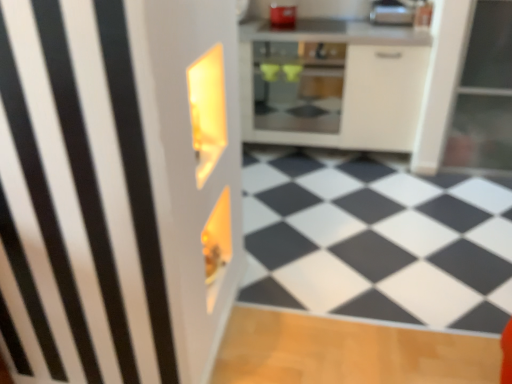
Measure the distance between point (351,105) and camera.

They are 9.46 feet apart.

In order to face silver metallic toaster at upper right, which ranks as the first appliance in right-to-left order, should I rotate leftwards or rightwards?

A 17.319 degree turn to the right will do.

Locate an element on the screen. white glossy cabinet at center is located at coordinates (332, 84).

From a real-world perspective, is white glossy cabinet at center under metallic silver toaster at upper center, which is the second appliance in right-to-left order?

Yes, from a real-world perspective, white glossy cabinet at center is beneath metallic silver toaster at upper center, which is the second appliance in right-to-left order.

Could you tell me if white glossy cabinet at center is turned towards metallic silver toaster at upper center, which is the second appliance in right-to-left order?

No, white glossy cabinet at center is not aimed at metallic silver toaster at upper center, which is the second appliance in right-to-left order.

Is white glossy cabinet at center beside metallic silver toaster at upper center, positioned as the 1th appliance in left-to-right order?

white glossy cabinet at center and metallic silver toaster at upper center, positioned as the 1th appliance in left-to-right order, are not in contact.

I want to click on the 1st appliance above the matte glass oven at center (from the image's perspective), so click(392, 12).

Is matte glass oven at center bigger than silver metallic toaster at upper right, which ranks as the first appliance in right-to-left order?

Yes.

Could you tell me if matte glass oven at center is turned towards silver metallic toaster at upper right, the 2th appliance when ordered from left to right?

No, matte glass oven at center does not turn towards silver metallic toaster at upper right, the 2th appliance when ordered from left to right.

Are matte glass oven at center and silver metallic toaster at upper right, which ranks as the first appliance in right-to-left order, located far from each other?

That's not correct — matte glass oven at center is a little close to silver metallic toaster at upper right, which ranks as the first appliance in right-to-left order.

From a real-world perspective, is metallic silver toaster at upper center, positioned as the 1th appliance in left-to-right order, on top of matte glass oven at center?

Correct, in the physical world, metallic silver toaster at upper center, positioned as the 1th appliance in left-to-right order, is higher than matte glass oven at center.

Does metallic silver toaster at upper center, which is the second appliance in right-to-left order, come in front of matte glass oven at center?

No, metallic silver toaster at upper center, which is the second appliance in right-to-left order, is further to the viewer.

Can we say metallic silver toaster at upper center, positioned as the 1th appliance in left-to-right order, lies outside matte glass oven at center?

Yes.

In the scene shown: How many degrees apart are the facing directions of metallic silver toaster at upper center, which is the second appliance in right-to-left order, and matte glass oven at center?

0.00147 degrees.

From a real-world perspective, which object stands above the other?

In real-world perspective, silver metallic toaster at upper right, the 2th appliance when ordered from left to right, is above.

From the image's perspective, starting from the matte glass oven at center, which appliance is the 1st one above? Please provide its 2D coordinates.

[(392, 12)]

Is there a large distance between silver metallic toaster at upper right, the 2th appliance when ordered from left to right, and matte glass oven at center?

No.

Who is taller, silver metallic toaster at upper right, which ranks as the first appliance in right-to-left order, or metallic silver toaster at upper center, which is the second appliance in right-to-left order?

Standing taller between the two is silver metallic toaster at upper right, which ranks as the first appliance in right-to-left order.

Can you confirm if silver metallic toaster at upper right, which ranks as the first appliance in right-to-left order, is bigger than metallic silver toaster at upper center, positioned as the 1th appliance in left-to-right order?

Yes, silver metallic toaster at upper right, which ranks as the first appliance in right-to-left order, is bigger than metallic silver toaster at upper center, positioned as the 1th appliance in left-to-right order.

Are silver metallic toaster at upper right, which ranks as the first appliance in right-to-left order, and metallic silver toaster at upper center, which is the second appliance in right-to-left order, making contact?

No, silver metallic toaster at upper right, which ranks as the first appliance in right-to-left order, is not next to metallic silver toaster at upper center, which is the second appliance in right-to-left order.

Which object is positioned more to the left, silver metallic toaster at upper right, the 2th appliance when ordered from left to right, or metallic silver toaster at upper center, positioned as the 1th appliance in left-to-right order?

From the viewer's perspective, metallic silver toaster at upper center, positioned as the 1th appliance in left-to-right order, appears more on the left side.

Considering the relative sizes of matte glass oven at center and metallic silver toaster at upper center, which is the second appliance in right-to-left order, in the image provided, is matte glass oven at center bigger than metallic silver toaster at upper center, which is the second appliance in right-to-left order,?

Correct, matte glass oven at center is larger in size than metallic silver toaster at upper center, which is the second appliance in right-to-left order.

Considering the positions of point (292, 64) and point (291, 12), is point (292, 64) closer or farther from the camera than point (291, 12)?

Point (292, 64).

From a real-world perspective, which is physically above, matte glass oven at center or metallic silver toaster at upper center, which is the second appliance in right-to-left order?

From a 3D spatial view, metallic silver toaster at upper center, which is the second appliance in right-to-left order, is above.

How many degrees apart are the facing directions of metallic silver toaster at upper center, which is the second appliance in right-to-left order, and white glossy cabinet at center?

0.293 degrees.

From a real-world perspective, which object rests below the other?

white glossy cabinet at center is physically lower.

Which object is positioned more to the right, metallic silver toaster at upper center, positioned as the 1th appliance in left-to-right order, or white glossy cabinet at center?

white glossy cabinet at center.

Is metallic silver toaster at upper center, which is the second appliance in right-to-left order, closer to the viewer compared to white glossy cabinet at center?

No.

This screenshot has height=384, width=512. Find the location of `appliance that appears on the left of white glossy cabinet at center`. appliance that appears on the left of white glossy cabinet at center is located at coordinates (283, 14).

I want to click on appliance on the right of the matte glass oven at center, so click(392, 12).

Based on the photo, estimate the real-world distances between objects in this image. Which object is closer to metallic silver toaster at upper center, positioned as the 1th appliance in left-to-right order, silver metallic toaster at upper right, the 2th appliance when ordered from left to right, or matte glass oven at center?

matte glass oven at center is positioned closer to the anchor metallic silver toaster at upper center, positioned as the 1th appliance in left-to-right order.

Looking at the image, which one is located closer to metallic silver toaster at upper center, positioned as the 1th appliance in left-to-right order, silver metallic toaster at upper right, which ranks as the first appliance in right-to-left order, or white glossy cabinet at center?

white glossy cabinet at center is positioned closer to the anchor metallic silver toaster at upper center, positioned as the 1th appliance in left-to-right order.

Based on the photo, which object lies nearer to the anchor point matte glass oven at center, white glossy cabinet at center or metallic silver toaster at upper center, positioned as the 1th appliance in left-to-right order?

Based on the image, white glossy cabinet at center appears to be nearer to matte glass oven at center.

From the image, which object appears to be nearer to white glossy cabinet at center, matte glass oven at center or silver metallic toaster at upper right, which ranks as the first appliance in right-to-left order?

Based on the image, matte glass oven at center appears to be nearer to white glossy cabinet at center.

Based on their spatial positions, is metallic silver toaster at upper center, which is the second appliance in right-to-left order, or matte glass oven at center further from silver metallic toaster at upper right, which ranks as the first appliance in right-to-left order?

Based on the image, matte glass oven at center appears to be further to silver metallic toaster at upper right, which ranks as the first appliance in right-to-left order.

When comparing their distances from matte glass oven at center, does silver metallic toaster at upper right, which ranks as the first appliance in right-to-left order, or metallic silver toaster at upper center, which is the second appliance in right-to-left order, seem closer?

Based on the image, metallic silver toaster at upper center, which is the second appliance in right-to-left order, appears to be nearer to matte glass oven at center.

From the image, which object appears to be nearer to matte glass oven at center, metallic silver toaster at upper center, positioned as the 1th appliance in left-to-right order, or white glossy cabinet at center?

white glossy cabinet at center.

From the image, which object appears to be farther from silver metallic toaster at upper right, which ranks as the first appliance in right-to-left order, white glossy cabinet at center or metallic silver toaster at upper center, which is the second appliance in right-to-left order?

metallic silver toaster at upper center, which is the second appliance in right-to-left order, is positioned further to the anchor silver metallic toaster at upper right, which ranks as the first appliance in right-to-left order.

Where is `cabinetry situated between metallic silver toaster at upper center, which is the second appliance in right-to-left order, and silver metallic toaster at upper right, which ranks as the first appliance in right-to-left order, from left to right`? The image size is (512, 384). cabinetry situated between metallic silver toaster at upper center, which is the second appliance in right-to-left order, and silver metallic toaster at upper right, which ranks as the first appliance in right-to-left order, from left to right is located at coordinates (332, 84).

The width and height of the screenshot is (512, 384). I want to click on cabinetry between matte glass oven at center and silver metallic toaster at upper right, the 2th appliance when ordered from left to right, so click(332, 84).

Where is `oven between metallic silver toaster at upper center, positioned as the 1th appliance in left-to-right order, and silver metallic toaster at upper right, the 2th appliance when ordered from left to right`? oven between metallic silver toaster at upper center, positioned as the 1th appliance in left-to-right order, and silver metallic toaster at upper right, the 2th appliance when ordered from left to right is located at coordinates (298, 85).

I want to click on oven between metallic silver toaster at upper center, positioned as the 1th appliance in left-to-right order, and white glossy cabinet at center vertically, so click(298, 85).